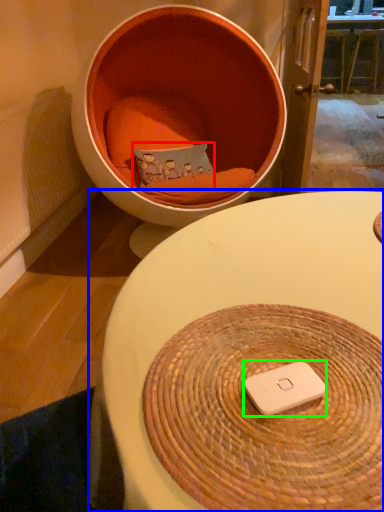
Question: Considering the real-world distances, which object is closest to pillow (highlighted by a red box)? table (highlighted by a blue box) or ipod (highlighted by a green box).

Choices:
 (A) table
 (B) ipod

Answer: (A)